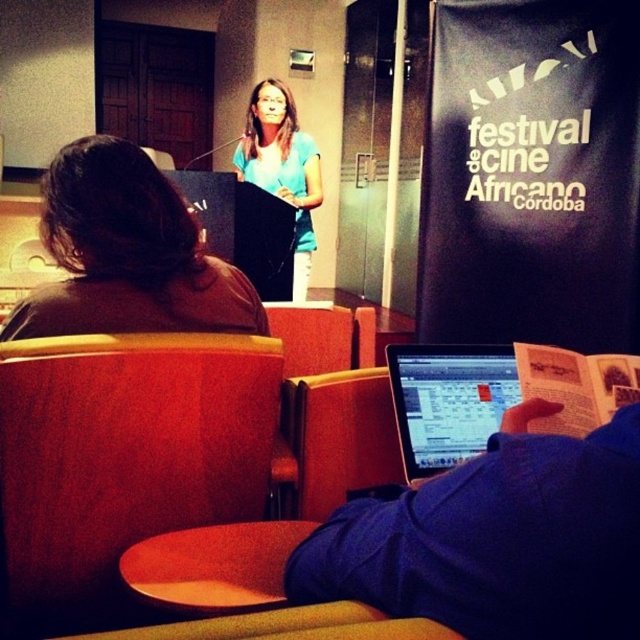
Question: Which point appears closest to the camera in this image?

Choices:
 (A) (102, 275)
 (B) (400, 413)

Answer: (B)

Question: Which of the following is the farthest from the observer?

Choices:
 (A) (451, 369)
 (B) (161, 298)
 (C) (19, 499)

Answer: (B)

Question: Considering the real-world distances, which object is closest to the matte blue shirt at center?

Choices:
 (A) brown hair at upper left
 (B) matte red chair at left
 (C) silver metallic laptop at center

Answer: (A)

Question: Can you confirm if matte red chair at left is positioned below matte blue shirt at center?

Choices:
 (A) no
 (B) yes

Answer: (B)

Question: Is brown hair at upper left positioned at the back of matte blue shirt at center?

Choices:
 (A) no
 (B) yes

Answer: (A)

Question: Is the position of matte red chair at left less distant than that of silver metallic laptop at center?

Choices:
 (A) yes
 (B) no

Answer: (A)